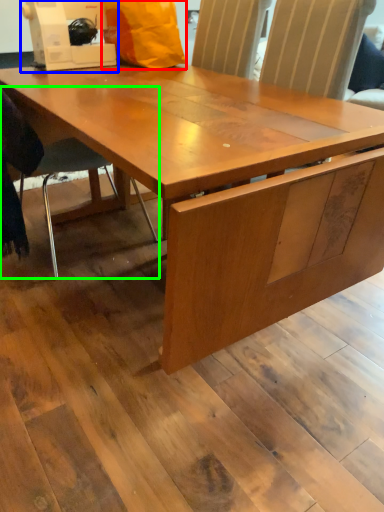
Question: Based on their relative distances, which object is nearer to paper bag (highlighted by a red box)? Choose from sewing machine (highlighted by a blue box) and chair (highlighted by a green box).

Choices:
 (A) sewing machine
 (B) chair

Answer: (A)